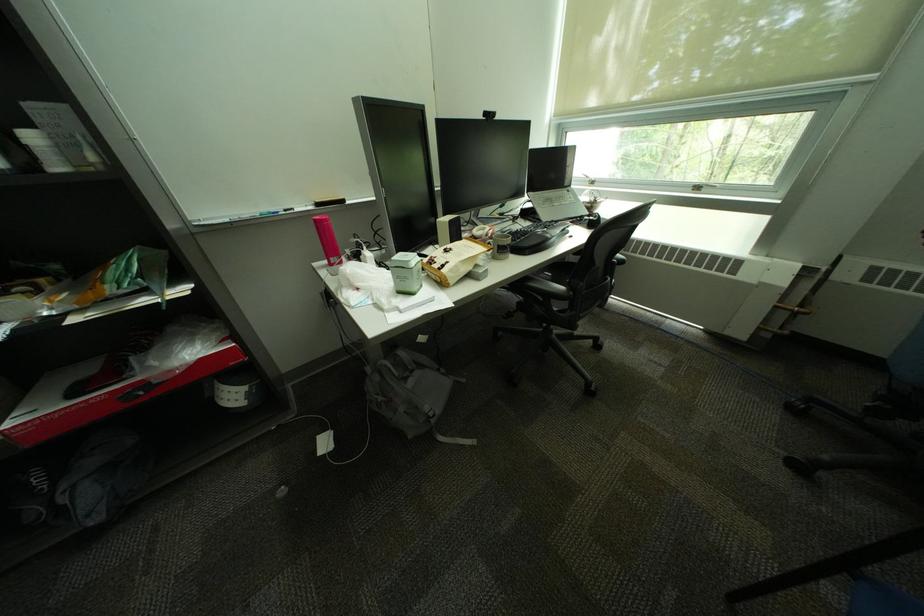
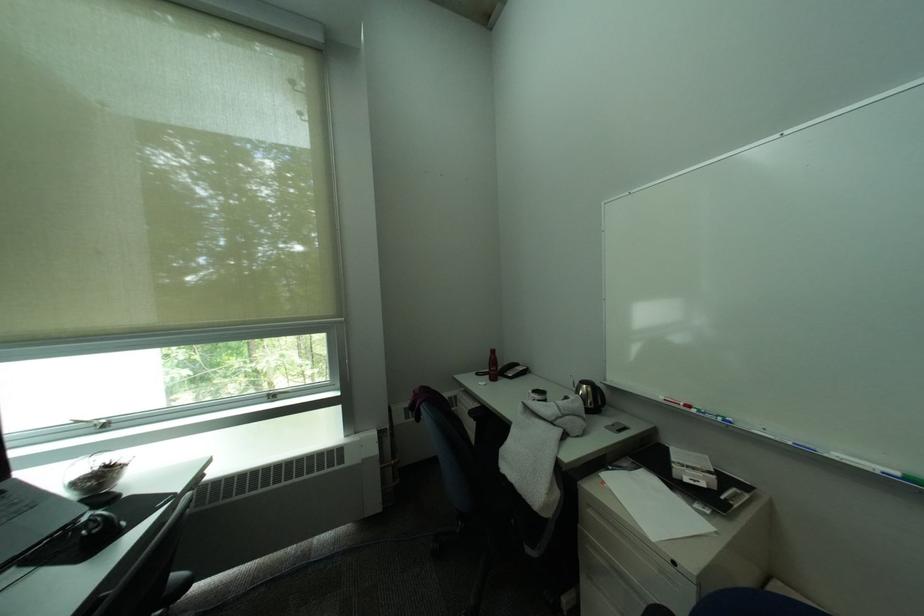
Locate, in the second image, the point that corresponds to point 606,217 in the first image.

(106, 528)